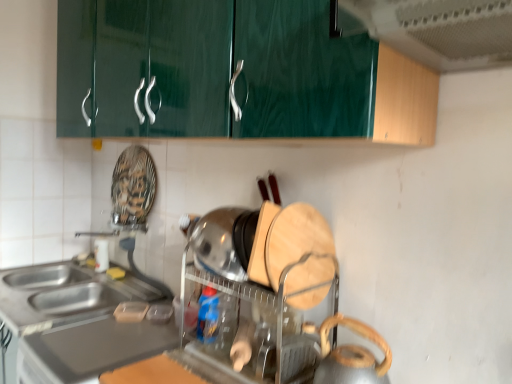
Question: From the image's perspective, is satin silver countertop at lower left on metallic silver kettle at lower right, which ranks as the first appliance in front-to-back order?

Choices:
 (A) yes
 (B) no

Answer: (B)

Question: Can you confirm if satin silver countertop at lower left is shorter than metallic silver kettle at lower right, arranged as the 2th appliance when viewed from the back?

Choices:
 (A) yes
 (B) no

Answer: (A)

Question: Is the surface of satin silver countertop at lower left in direct contact with metallic silver kettle at lower right, which ranks as the first appliance in front-to-back order?

Choices:
 (A) no
 (B) yes

Answer: (A)

Question: Is satin silver countertop at lower left wider than metallic silver kettle at lower right, arranged as the 2th appliance when viewed from the back?

Choices:
 (A) no
 (B) yes

Answer: (B)

Question: Is satin silver countertop at lower left outside metallic silver kettle at lower right, arranged as the 2th appliance when viewed from the back?

Choices:
 (A) yes
 (B) no

Answer: (A)

Question: Considering the positions of green glossy exhaust hood at upper center and wooden cutting board at center, the first appliance viewed from the back, in the image, is green glossy exhaust hood at upper center taller or shorter than wooden cutting board at center, the first appliance viewed from the back,?

Choices:
 (A) tall
 (B) short

Answer: (B)

Question: In the image, is green glossy exhaust hood at upper center on the left side or the right side of wooden cutting board at center, marked as the 2th appliance in a front-to-back arrangement?

Choices:
 (A) right
 (B) left

Answer: (A)

Question: From a real-world perspective, relative to wooden cutting board at center, marked as the 2th appliance in a front-to-back arrangement, is green glossy exhaust hood at upper center vertically above or below?

Choices:
 (A) below
 (B) above

Answer: (B)

Question: From the image's perspective, is green glossy exhaust hood at upper center positioned above or below wooden cutting board at center, the first appliance viewed from the back?

Choices:
 (A) below
 (B) above

Answer: (B)

Question: From the image's perspective, is satin silver countertop at lower left above or below green glossy exhaust hood at upper center?

Choices:
 (A) above
 (B) below

Answer: (B)

Question: In terms of height, does satin silver countertop at lower left look taller or shorter compared to green glossy exhaust hood at upper center?

Choices:
 (A) short
 (B) tall

Answer: (A)

Question: Is satin silver countertop at lower left inside or outside of green glossy exhaust hood at upper center?

Choices:
 (A) inside
 (B) outside

Answer: (B)

Question: Considering their positions, is satin silver countertop at lower left located in front of or behind green glossy exhaust hood at upper center?

Choices:
 (A) behind
 (B) front

Answer: (A)

Question: In the image, is metallic silver kettle at lower right, which ranks as the first appliance in front-to-back order, positioned in front of or behind green glossy exhaust hood at upper center?

Choices:
 (A) behind
 (B) front

Answer: (A)

Question: From the image's perspective, relative to green glossy exhaust hood at upper center, is metallic silver kettle at lower right, arranged as the 2th appliance when viewed from the back, above or below?

Choices:
 (A) above
 (B) below

Answer: (B)